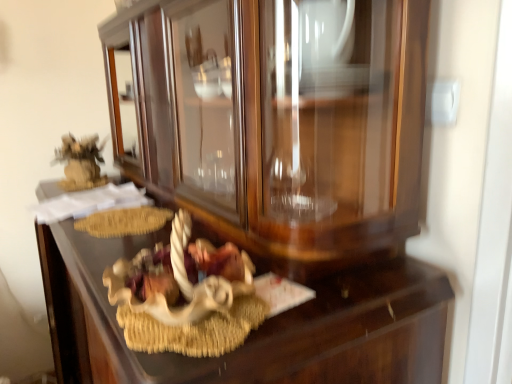
Question: From the image's perspective, does wooden drawer at center appear lower than white matte nativity scene at center?

Choices:
 (A) no
 (B) yes

Answer: (B)

Question: Can you confirm if wooden drawer at center is bigger than white matte nativity scene at center?

Choices:
 (A) yes
 (B) no

Answer: (A)

Question: From a real-world perspective, is wooden drawer at center on top of white matte nativity scene at center?

Choices:
 (A) yes
 (B) no

Answer: (B)

Question: Is wooden drawer at center oriented towards white matte nativity scene at center?

Choices:
 (A) no
 (B) yes

Answer: (A)

Question: Does wooden drawer at center lie behind white matte nativity scene at center?

Choices:
 (A) yes
 (B) no

Answer: (B)

Question: Would you say wooden drawer at center is a long distance from white matte nativity scene at center?

Choices:
 (A) yes
 (B) no

Answer: (B)

Question: Is white matte nativity scene at center shorter than wooden drawer at center?

Choices:
 (A) no
 (B) yes

Answer: (B)

Question: Considering the relative sizes of white matte nativity scene at center and wooden drawer at center in the image provided, is white matte nativity scene at center bigger than wooden drawer at center?

Choices:
 (A) no
 (B) yes

Answer: (A)

Question: Could you tell me if white matte nativity scene at center is turned towards wooden drawer at center?

Choices:
 (A) no
 (B) yes

Answer: (A)

Question: Is white matte nativity scene at center not close to wooden drawer at center?

Choices:
 (A) no
 (B) yes

Answer: (A)

Question: Would you say white matte nativity scene at center contains wooden drawer at center?

Choices:
 (A) yes
 (B) no

Answer: (B)

Question: Is white matte nativity scene at center further to the viewer compared to wooden drawer at center?

Choices:
 (A) yes
 (B) no

Answer: (A)

Question: Is point (187, 362) closer or farther from the camera than point (132, 347)?

Choices:
 (A) closer
 (B) farther

Answer: (A)